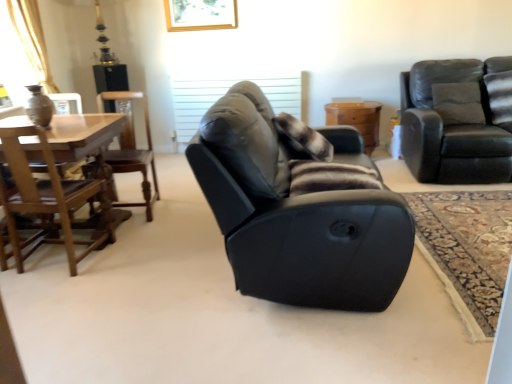
Image resolution: width=512 pixels, height=384 pixels. Identify the location of black leather recliner at center, the 3th chair in the left-to-right sequence. (295, 217).

What is the approximate width of velvet dark gray couch at upper right, which is counted as the 4th chair, starting from the left?

1.10 meters.

The width and height of the screenshot is (512, 384). What do you see at coordinates (458, 120) in the screenshot? I see `velvet dark gray couch at upper right, which appears as the 1th chair when viewed from the right` at bounding box center [458, 120].

Describe the element at coordinates (357, 120) in the screenshot. The image size is (512, 384). I see `wooden chest at center` at that location.

In order to click on brown fuzzy pillow at center in this screenshot , I will do `click(302, 139)`.

This screenshot has width=512, height=384. What do you see at coordinates (50, 200) in the screenshot?
I see `wooden chair at left, the 4th chair from the right` at bounding box center [50, 200].

In order to face wooden chair at left, marked as the 1th chair in a left-to-right arrangement, should I rotate leftwards or rightwards?

A 25.278 degree turn to the left will do.

Where is `black leather recliner at center, which appears as the 2th chair when viewed from the right`? This screenshot has width=512, height=384. black leather recliner at center, which appears as the 2th chair when viewed from the right is located at coordinates (295, 217).

Is wooden chest at center outside of wooden chair at left, marked as the 3th chair in a right-to-left arrangement?

That's correct, wooden chest at center is outside of wooden chair at left, marked as the 3th chair in a right-to-left arrangement.

Measure the distance between wooden chest at center and wooden chair at left, placed as the second chair when sorted from left to right.

2.00 meters.

Which object is closer to the camera, wooden chest at center or wooden chair at left, placed as the second chair when sorted from left to right?

wooden chair at left, placed as the second chair when sorted from left to right, is in front.

Where is `table that appears below the wooden chair at left, placed as the second chair when sorted from left to right (from a real-world perspective)`? The image size is (512, 384). table that appears below the wooden chair at left, placed as the second chair when sorted from left to right (from a real-world perspective) is located at coordinates (357, 120).

Considering the sizes of objects wooden chest at center and velvet dark gray couch at upper right, which is counted as the 4th chair, starting from the left, in the image provided, who is shorter, wooden chest at center or velvet dark gray couch at upper right, which is counted as the 4th chair, starting from the left,?

wooden chest at center is shorter.

Is wooden chest at center spatially inside velvet dark gray couch at upper right, which is counted as the 4th chair, starting from the left, or outside of it?

wooden chest at center cannot be found inside velvet dark gray couch at upper right, which is counted as the 4th chair, starting from the left.

From a real-world perspective, is wooden chest at center above or below velvet dark gray couch at upper right, which appears as the 1th chair when viewed from the right?

wooden chest at center is below velvet dark gray couch at upper right, which appears as the 1th chair when viewed from the right.

Which object is thinner, wooden chest at center or velvet dark gray couch at upper right, which is counted as the 4th chair, starting from the left?

Thinner between the two is wooden chest at center.

Is point (311, 142) positioned after point (106, 92)?

No, (311, 142) is closer to viewer.

Between brown fuzzy pillow at center and wooden chair at left, placed as the second chair when sorted from left to right, which one has more height?

With more height is wooden chair at left, placed as the second chair when sorted from left to right.

Considering the sizes of brown fuzzy pillow at center and wooden chair at left, marked as the 3th chair in a right-to-left arrangement, in the image, is brown fuzzy pillow at center wider or thinner than wooden chair at left, marked as the 3th chair in a right-to-left arrangement,?

Clearly, brown fuzzy pillow at center has less width compared to wooden chair at left, marked as the 3th chair in a right-to-left arrangement.

What's the angular difference between brown fuzzy pillow at center and wooden chair at left, placed as the second chair when sorted from left to right,'s facing directions?

82.3 degrees separate the facing orientations of brown fuzzy pillow at center and wooden chair at left, placed as the second chair when sorted from left to right.

Does wooden chair at left, the 4th chair from the right, appear on the left side of brown fuzzy pillow at center?

Yes, wooden chair at left, the 4th chair from the right, is to the left of brown fuzzy pillow at center.

Could brown fuzzy pillow at center be considered to be inside wooden chair at left, marked as the 1th chair in a left-to-right arrangement?

No, wooden chair at left, marked as the 1th chair in a left-to-right arrangement, does not contain brown fuzzy pillow at center.

Is wooden chair at left, marked as the 1th chair in a left-to-right arrangement, behind brown fuzzy pillow at center?

That is False.

Based on the photo, from the image's perspective, would you say wooden chair at left, marked as the 1th chair in a left-to-right arrangement, is shown under brown fuzzy pillow at center?

Yes, from the image's perspective, wooden chair at left, marked as the 1th chair in a left-to-right arrangement, is below brown fuzzy pillow at center.

From a real-world perspective, is velvet dark gray couch at upper right, which appears as the 1th chair when viewed from the right, on wooden chest at center?

Correct, in the physical world, velvet dark gray couch at upper right, which appears as the 1th chair when viewed from the right, is higher than wooden chest at center.

Considering the positions of objects velvet dark gray couch at upper right, which appears as the 1th chair when viewed from the right, and wooden chest at center in the image provided, who is in front, velvet dark gray couch at upper right, which appears as the 1th chair when viewed from the right, or wooden chest at center?

A: velvet dark gray couch at upper right, which appears as the 1th chair when viewed from the right, is closer to the camera.

Would you consider velvet dark gray couch at upper right, which is counted as the 4th chair, starting from the left, to be distant from wooden chest at center?

Actually, velvet dark gray couch at upper right, which is counted as the 4th chair, starting from the left, and wooden chest at center are a little close together.

Locate an element on the screen. The width and height of the screenshot is (512, 384). chair to the right of wooden chest at center is located at coordinates (458, 120).

From the image's perspective, which object appears higher, wooden chair at left, marked as the 3th chair in a right-to-left arrangement, or black leather recliner at center, the 3th chair in the left-to-right sequence?

wooden chair at left, marked as the 3th chair in a right-to-left arrangement, from the image's perspective.

Considering the points (115, 93) and (286, 289), which point is in front, point (115, 93) or point (286, 289)?

The point (286, 289) is closer to the camera.

From the picture: Which object is positioned more to the right, wooden chair at left, marked as the 3th chair in a right-to-left arrangement, or black leather recliner at center, which appears as the 2th chair when viewed from the right?

Positioned to the right is black leather recliner at center, which appears as the 2th chair when viewed from the right.

In order to click on the 2nd chair behind the black leather recliner at center, which appears as the 2th chair when viewed from the right in this screenshot , I will do `click(131, 146)`.

Is velvet dark gray couch at upper right, which is counted as the 4th chair, starting from the left, directly adjacent to brown fuzzy pillow at center?

They are not placed beside each other.

Considering the sizes of velvet dark gray couch at upper right, which is counted as the 4th chair, starting from the left, and brown fuzzy pillow at center in the image, is velvet dark gray couch at upper right, which is counted as the 4th chair, starting from the left, taller or shorter than brown fuzzy pillow at center?

In the image, velvet dark gray couch at upper right, which is counted as the 4th chair, starting from the left, appears to be taller than brown fuzzy pillow at center.

Does velvet dark gray couch at upper right, which appears as the 1th chair when viewed from the right, have a smaller size compared to brown fuzzy pillow at center?

No.

Locate an element on the screen. the 1st chair above the wooden chest at center (from a real-world perspective) is located at coordinates (131, 146).

Which chair is the 1st one when counting from the front of the wooden chest at center? Please provide its 2D coordinates.

[(458, 120)]

Which object lies further to the anchor point wooden chest at center, wooden chair at left, marked as the 3th chair in a right-to-left arrangement, or black leather recliner at center, which appears as the 2th chair when viewed from the right?

black leather recliner at center, which appears as the 2th chair when viewed from the right, lies further to wooden chest at center than the other object.

Considering their positions, is velvet dark gray couch at upper right, which is counted as the 4th chair, starting from the left, positioned further to wooden chest at center than wooden chair at left, marked as the 1th chair in a left-to-right arrangement?

wooden chair at left, marked as the 1th chair in a left-to-right arrangement, lies further to wooden chest at center than the other object.

When comparing their distances from wooden chest at center, does velvet dark gray couch at upper right, which appears as the 1th chair when viewed from the right, or brown fuzzy pillow at center seem closer?

velvet dark gray couch at upper right, which appears as the 1th chair when viewed from the right.

From the image, which object appears to be farther from black leather recliner at center, the 3th chair in the left-to-right sequence, wooden chest at center or brown fuzzy pillow at center?

wooden chest at center lies further to black leather recliner at center, the 3th chair in the left-to-right sequence, than the other object.

Based on their spatial positions, is velvet dark gray couch at upper right, which is counted as the 4th chair, starting from the left, or brown fuzzy pillow at center closer to wooden chair at left, marked as the 3th chair in a right-to-left arrangement?

brown fuzzy pillow at center.

Which object lies nearer to the anchor point wooden chair at left, the 4th chair from the right, black leather recliner at center, the 3th chair in the left-to-right sequence, or wooden chair at left, placed as the second chair when sorted from left to right?

The object closer to wooden chair at left, the 4th chair from the right, is wooden chair at left, placed as the second chair when sorted from left to right.

Consider the image. Looking at the image, which one is located further to wooden chair at left, placed as the second chair when sorted from left to right, brown fuzzy pillow at center or black leather recliner at center, which appears as the 2th chair when viewed from the right?

black leather recliner at center, which appears as the 2th chair when viewed from the right, is further to wooden chair at left, placed as the second chair when sorted from left to right.

Considering their positions, is wooden chair at left, marked as the 1th chair in a left-to-right arrangement, positioned closer to wooden chair at left, marked as the 3th chair in a right-to-left arrangement, than brown fuzzy pillow at center?

wooden chair at left, marked as the 1th chair in a left-to-right arrangement, lies closer to wooden chair at left, marked as the 3th chair in a right-to-left arrangement, than the other object.

This screenshot has width=512, height=384. I want to click on pillow located between wooden chair at left, marked as the 1th chair in a left-to-right arrangement, and wooden chest at center in the left-right direction, so click(x=302, y=139).

At what (x,y) coordinates should I click in order to perform the action: click on pillow between wooden chair at left, marked as the 3th chair in a right-to-left arrangement, and velvet dark gray couch at upper right, which is counted as the 4th chair, starting from the left, in the horizontal direction. Please return your answer as a coordinate pair (x, y). Image resolution: width=512 pixels, height=384 pixels. Looking at the image, I should click on (302, 139).

Locate an element on the screen. pillow located between black leather recliner at center, which appears as the 2th chair when viewed from the right, and wooden chest at center in the depth direction is located at coordinates (302, 139).

Identify the location of chair between wooden chair at left, marked as the 1th chair in a left-to-right arrangement, and black leather recliner at center, the 3th chair in the left-to-right sequence. (131, 146).